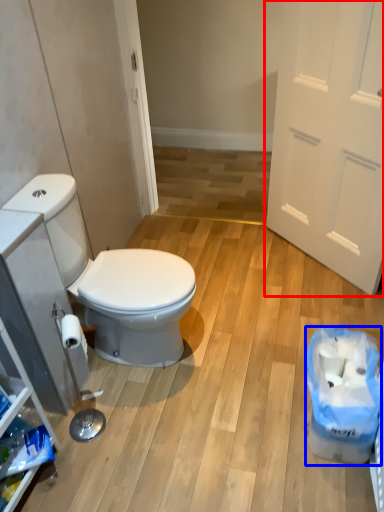
Question: Which object is further to the camera taking this photo, door (highlighted by a red box) or recycling bin (highlighted by a blue box)?

Choices:
 (A) door
 (B) recycling bin

Answer: (A)